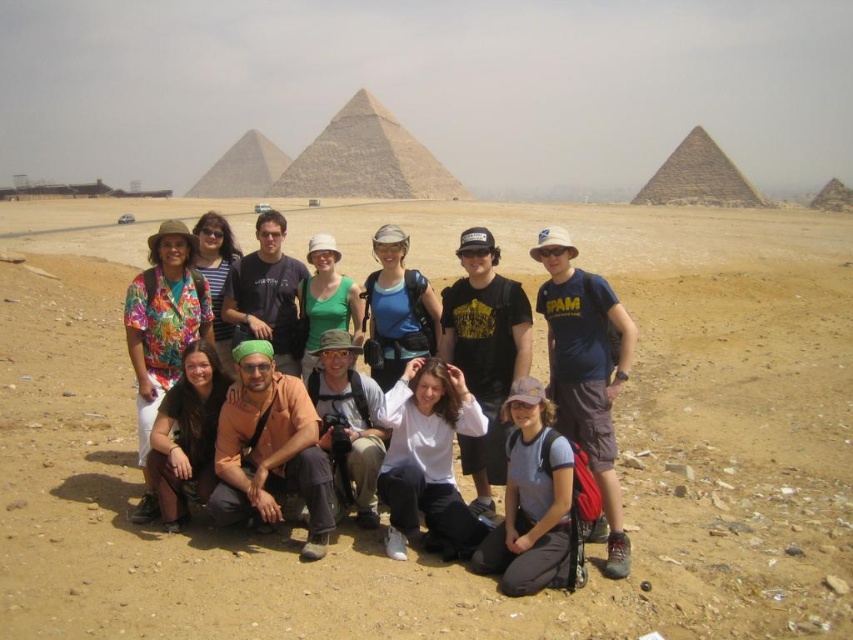
You are a photographer trying to arrange two tourists in a photo. The tourists are wearing a gray fabric shirt at lower center and a floral fabric shirt at left. Based on their current positions, which tourist is standing more to the left?

The floral fabric shirt at left is standing more to the left because the gray fabric shirt at lower center is positioned on the right side of it.